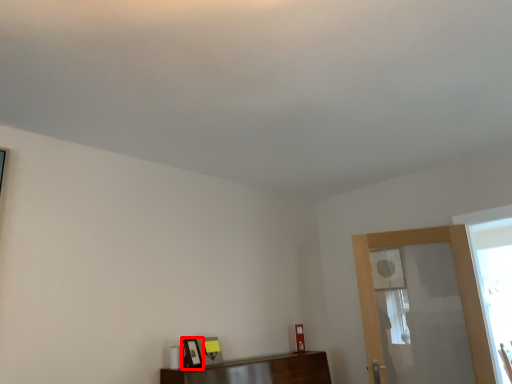
Question: From the image, what is the correct spatial relationship of picture frame (annotated by the red box) in relation to screen door?

Choices:
 (A) left
 (B) right

Answer: (A)